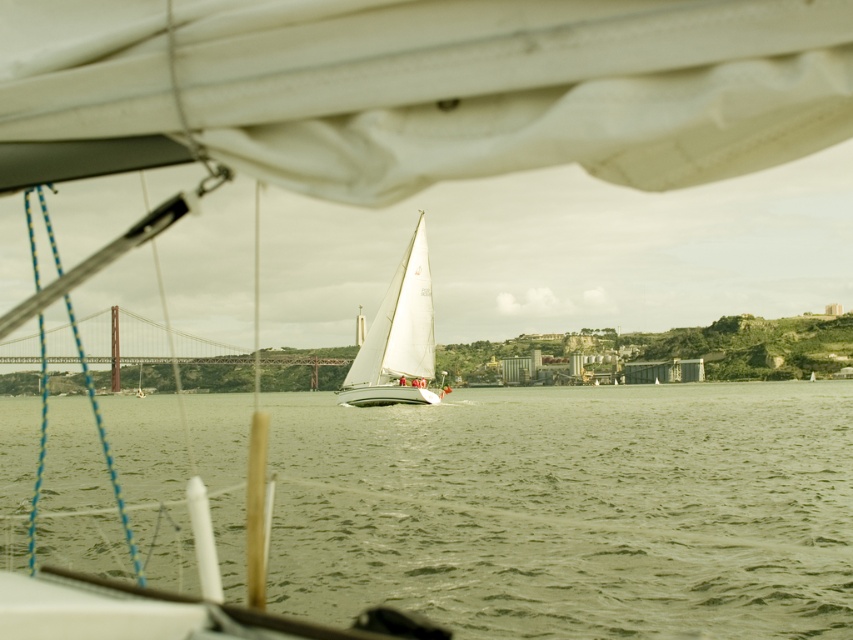
Does green water at center have a greater height compared to white matte sailboat at center?

In fact, green water at center may be shorter than white matte sailboat at center.

Measure the distance between point [196,417] and camera.

Point [196,417] and camera are 141.06 meters apart from each other.

Is point (405, 595) positioned in front of point (355, 392)?

Yes, point (405, 595) is closer to viewer.

The image size is (853, 640). What are the coordinates of `green water at center` in the screenshot? It's located at (572, 509).

Who is shorter, white matte sailboat at center or metallic bridge at left?

Standing shorter between the two is white matte sailboat at center.

Is white matte sailboat at center to the left of metallic bridge at left from the viewer's perspective?

No, white matte sailboat at center is not to the left of metallic bridge at left.

Who is more forward, (387, 305) or (49, 360)?

Positioned in front is point (387, 305).

This screenshot has width=853, height=640. I want to click on white matte sailboat at center, so click(397, 337).

Is point (619, 515) positioned behind point (68, 339)?

No, it is in front of (68, 339).

Which is below, green water at center or metallic bridge at left?

Positioned lower is green water at center.

Who is more forward, (120, 465) or (216, 349)?

Positioned in front is point (120, 465).

Locate an element on the screen. This screenshot has width=853, height=640. green water at center is located at coordinates (572, 509).